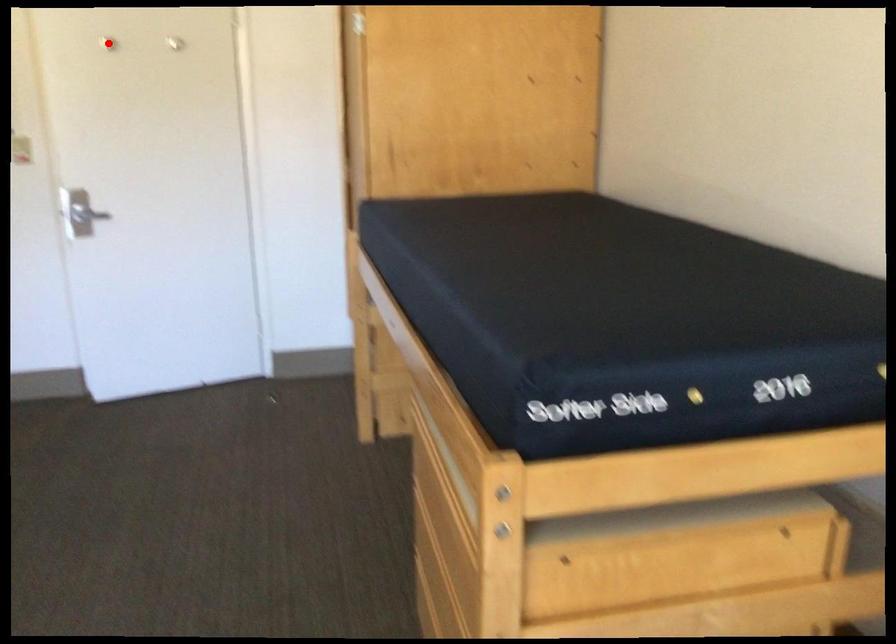
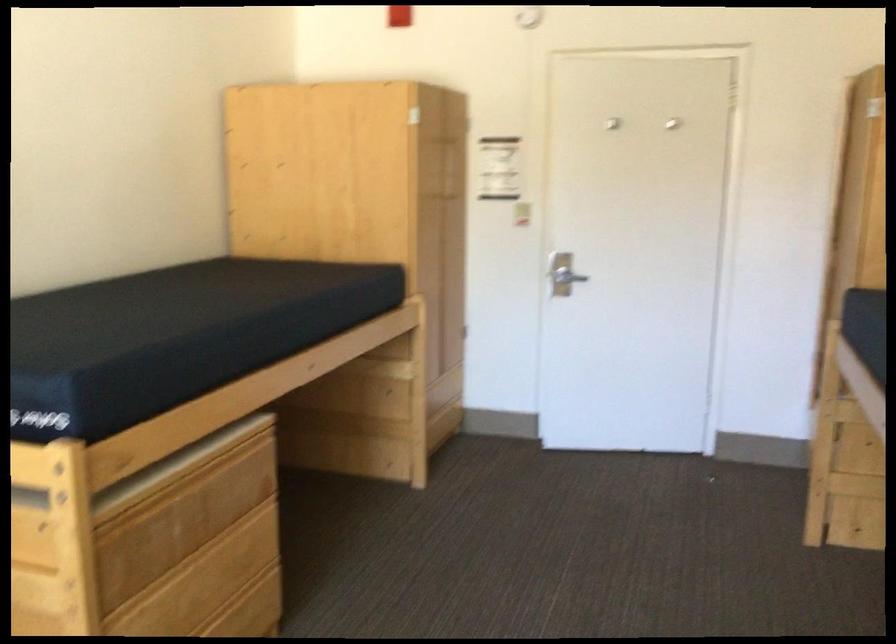
Question: I am providing you with two images of the same scene from different viewpoints. A red point is marked on the first image. Can you still see the location of the red point in image 2?

Choices:
 (A) Yes
 (B) No

Answer: (B)